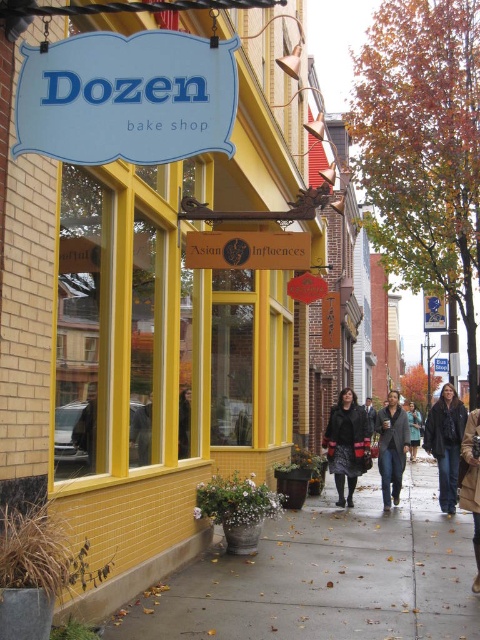
Question: Where is denim jacket at lower right located in relation to dark gray sweater at center in the image?

Choices:
 (A) right
 (B) left

Answer: (A)

Question: Considering the relative positions of brown leather jacket at lower right and brown leather jacket at center in the image provided, where is brown leather jacket at lower right located with respect to brown leather jacket at center?

Choices:
 (A) left
 (B) right

Answer: (A)

Question: Is yellow brick bake shop sign at upper left positioned in front of concrete sidewalk at lower center?

Choices:
 (A) no
 (B) yes

Answer: (B)

Question: Among these objects, which one is nearest to the camera?

Choices:
 (A) velvet black coat at center
 (B) brown leather jacket at lower right
 (C) yellow brick bake shop sign at upper left
 (D) concrete sidewalk at lower center

Answer: (C)

Question: Estimate the real-world distances between objects in this image. Which object is closer to the dark gray sweater at center?

Choices:
 (A) brown leather jacket at center
 (B) brown leather jacket at lower right
 (C) denim jacket at lower right
 (D) concrete sidewalk at lower center

Answer: (C)

Question: Estimate the real-world distances between objects in this image. Which object is closer to the brown leather jacket at lower right?

Choices:
 (A) concrete sidewalk at lower center
 (B) brown leather jacket at center
 (C) denim jacket at lower right

Answer: (A)